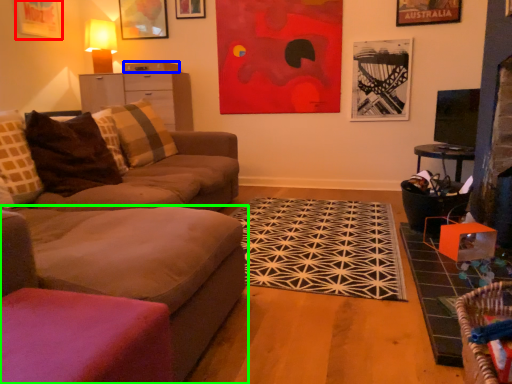
Question: Considering the real-world distances, which object is closest to picture frame (highlighted by a red box)? drawer (highlighted by a blue box) or studio couch (highlighted by a green box).

Choices:
 (A) drawer
 (B) studio couch

Answer: (A)